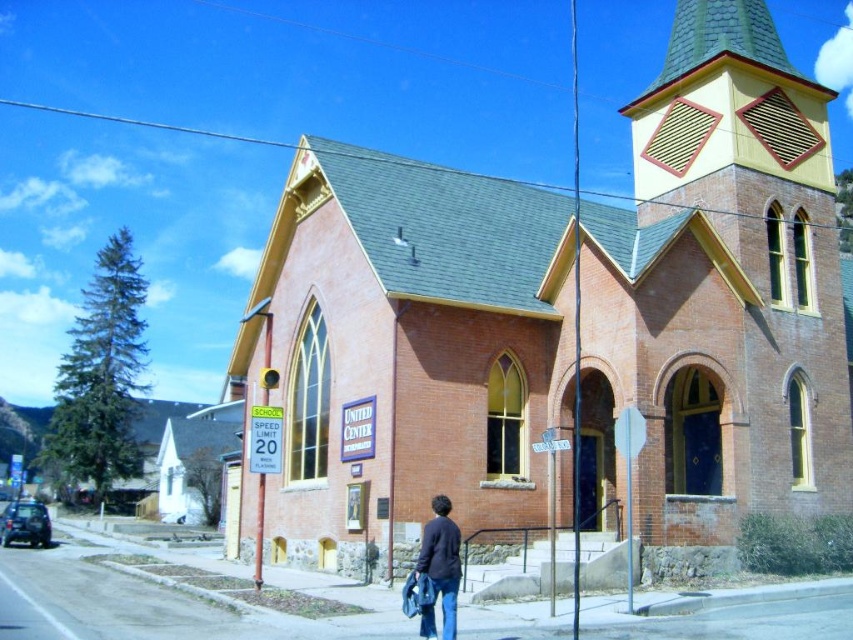
Is point (473, 310) closer to viewer compared to point (425, 541)?

No, it is behind (425, 541).

In the scene shown: Who is more forward, [318,412] or [432,560]?

Point [432,560]

You are a GUI agent. You are given a task and a screenshot of the screen. Output one action in this format:
    pyautogui.click(x=<x>, y=<y>)
    Task: Click on the red brick church at center
    The height and width of the screenshot is (640, 853).
    Given the screenshot: What is the action you would take?
    point(566,321)